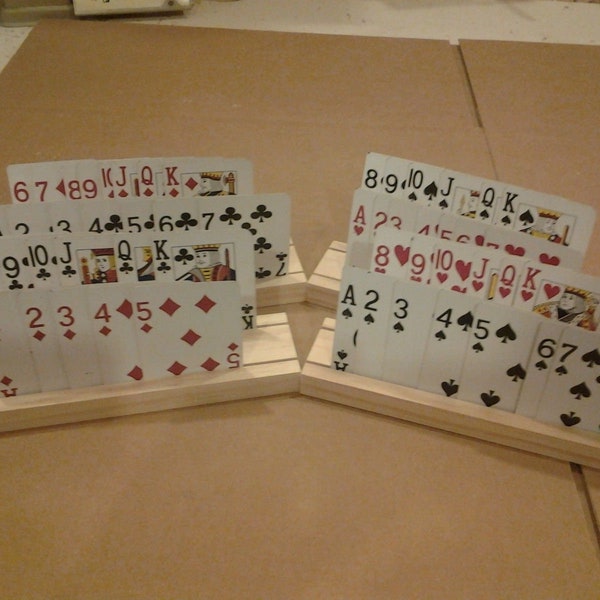
This screenshot has height=600, width=600. What are the coordinates of `handmade wooden playing card holders` in the screenshot? It's located at (280, 353), (297, 279), (316, 279), (316, 348).